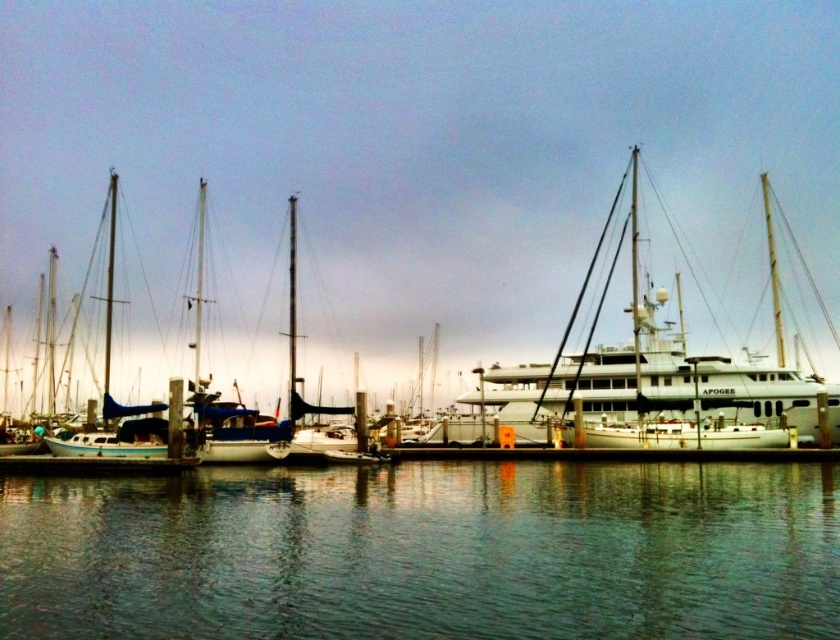
You are a photographer standing at the edge of the marina, wanting to capture a shot of the white glossy yacht at center without the green reflective water at lower center blocking the view. Is this possible given their positions?

The green reflective water at lower center is in front of the white glossy yacht at center, so it will block the view. To capture the yacht without the water blocking it, you would need to adjust your position or angle to position the yacht behind the water or find a higher vantage point.

You are standing on the dock and see the green reflective water at lower center and the white glossy yacht at center. Which object is closer to the bottom edge of the image?

The green reflective water at lower center is closer to the bottom edge of the image because it is located below the white glossy yacht at center.